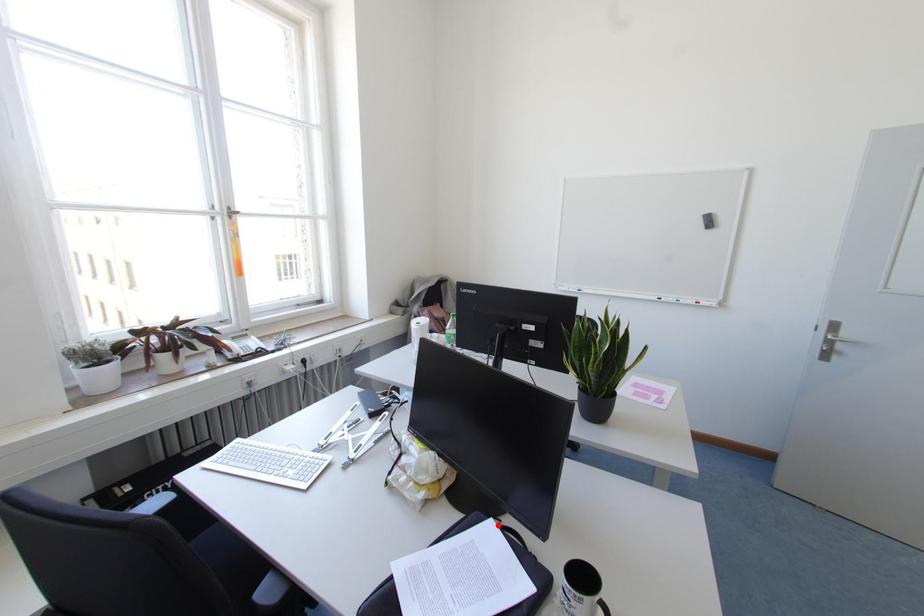
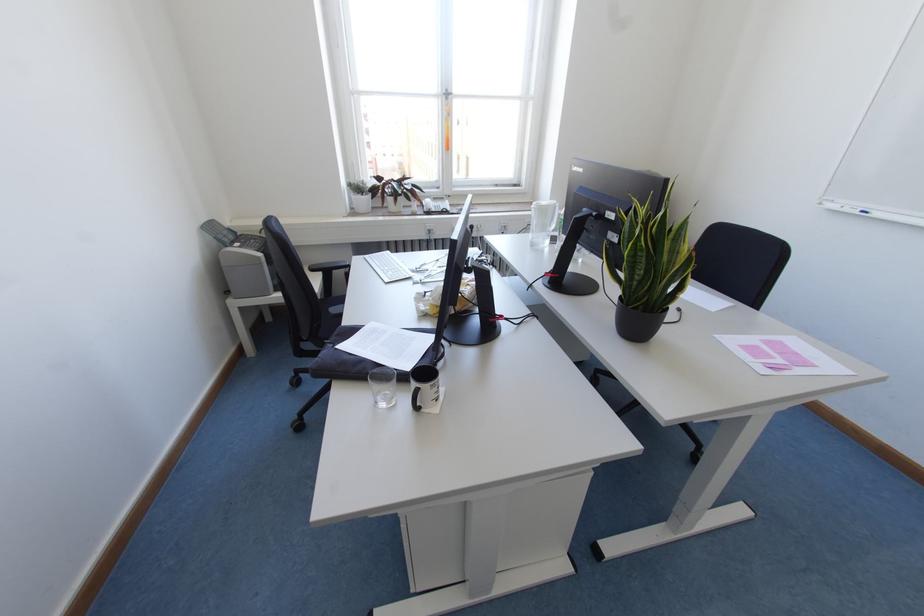
Question: I am providing you with two images of the same scene from different viewpoints. A red point is marked on the first image. Is the red point's position out of view in image 2?

Choices:
 (A) Yes
 (B) No

Answer: (B)